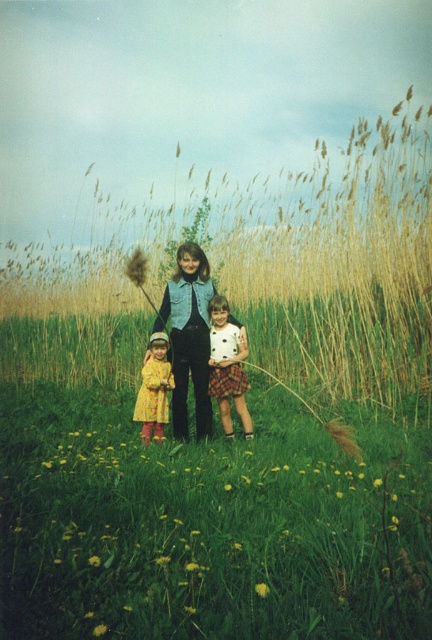
Question: Which object is the farthest from the denim vest at center?

Choices:
 (A) yellow cotton dress at center
 (B) white polka dot blouse at center

Answer: (A)

Question: Which point is closer to the camera taking this photo?

Choices:
 (A) (206, 352)
 (B) (158, 392)
 (C) (216, 388)

Answer: (A)

Question: Can you confirm if denim vest at center is positioned below white polka dot blouse at center?

Choices:
 (A) yes
 (B) no

Answer: (B)

Question: Which of the following is the farthest from the observer?

Choices:
 (A) (181, 429)
 (B) (153, 408)
 (C) (225, 394)

Answer: (C)

Question: Can you confirm if denim vest at center is smaller than yellow cotton dress at center?

Choices:
 (A) no
 (B) yes

Answer: (A)

Question: Considering the relative positions of denim vest at center and yellow cotton dress at center in the image provided, where is denim vest at center located with respect to yellow cotton dress at center?

Choices:
 (A) above
 (B) below

Answer: (A)